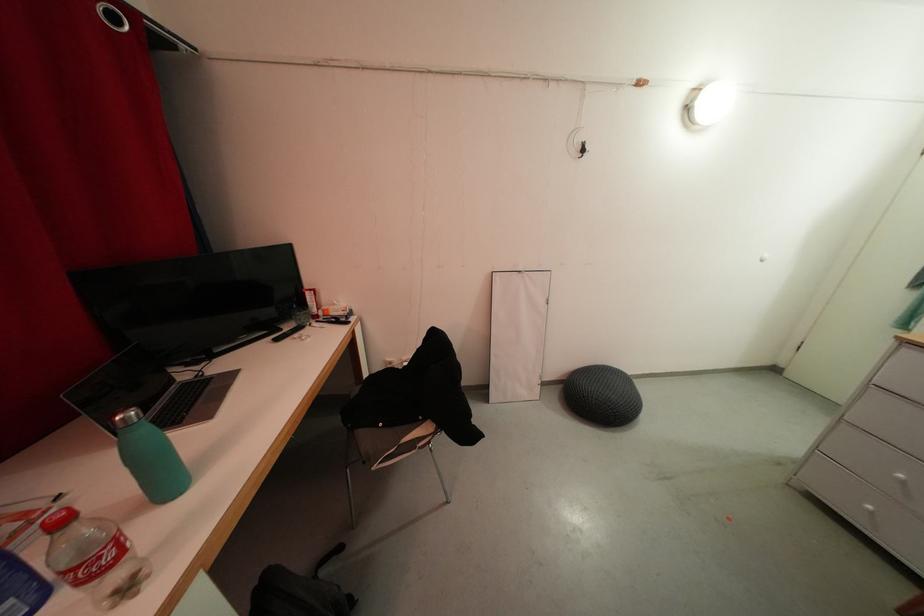
Find the location of `grey knitted pouf`. grey knitted pouf is located at coordinates (602, 395).